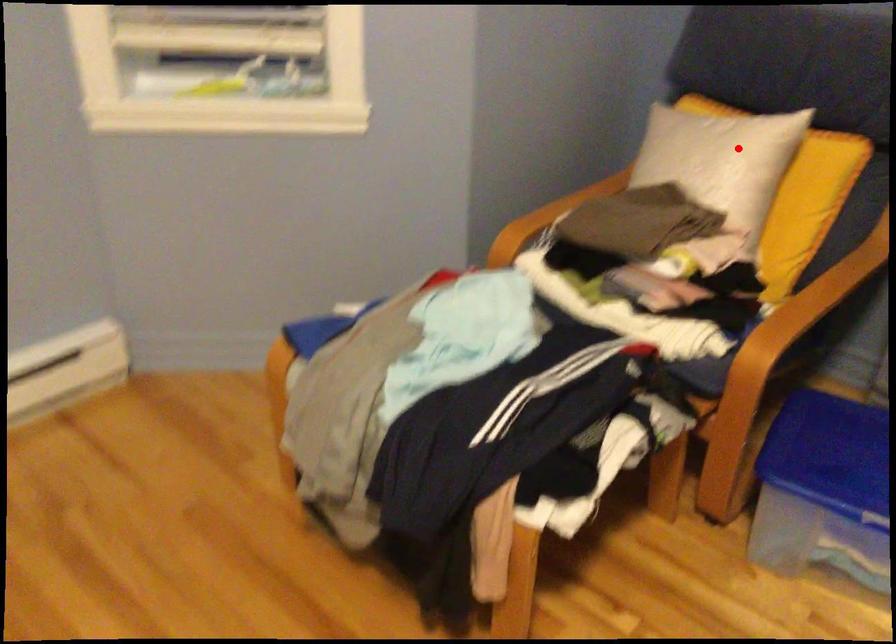
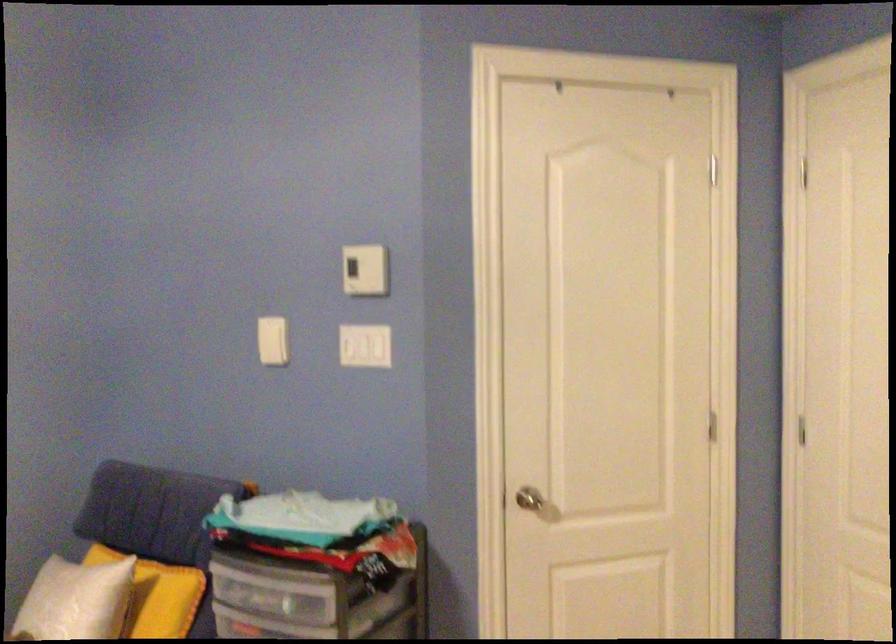
In the second image, find the point that corresponds to the highlighted location in the first image.

(74, 601)